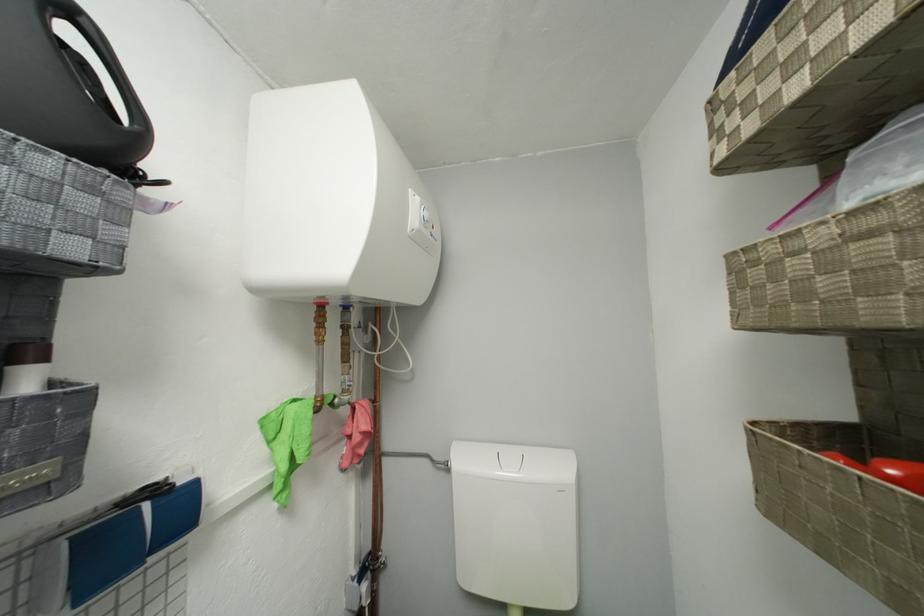
Image resolution: width=924 pixels, height=616 pixels. What do you see at coordinates (885, 469) in the screenshot?
I see `a red valve handle` at bounding box center [885, 469].